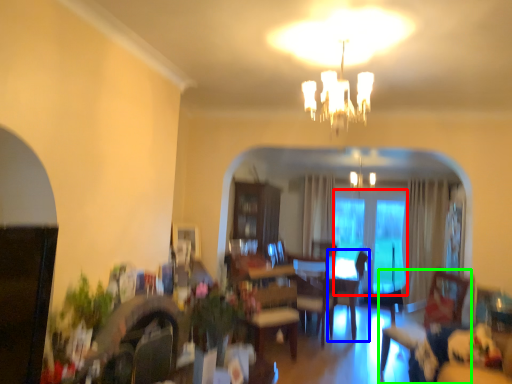
Question: Based on their relative distances, which object is nearer to glass door (highlighted by a red box)? Choose from armchair (highlighted by a blue box) and swivel chair (highlighted by a green box).

Choices:
 (A) armchair
 (B) swivel chair

Answer: (A)